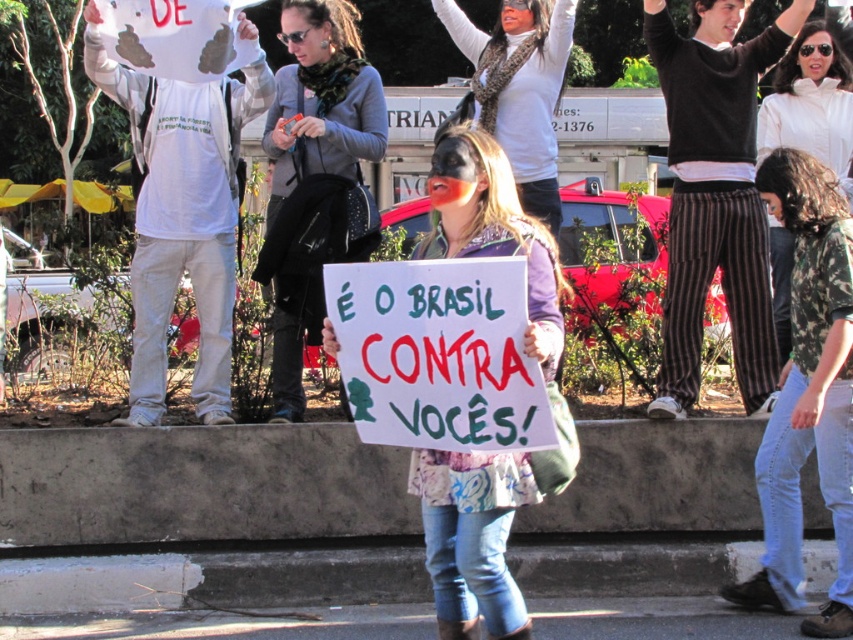
Question: Can you confirm if white matte shirt at left is positioned below green floral shirt at center?

Choices:
 (A) no
 (B) yes

Answer: (B)

Question: Can you confirm if white paper sign at center is smaller than matte black mask at center?

Choices:
 (A) no
 (B) yes

Answer: (B)

Question: Observing the image, what is the correct spatial positioning of dark brown striped pants at center in reference to white matte shirt at left?

Choices:
 (A) left
 (B) right

Answer: (B)

Question: Which object appears closest to the camera in this image?

Choices:
 (A) dark brown striped pants at center
 (B) white paper sign at center
 (C) white matte shirt at left

Answer: (B)

Question: Which point is closer to the camera?

Choices:
 (A) dark brown striped pants at center
 (B) black leather jacket at center
 (C) green floral shirt at center

Answer: (A)

Question: Which point is farther from the camera taking this photo?

Choices:
 (A) (734, 339)
 (B) (227, 216)
 (C) (815, 35)

Answer: (C)